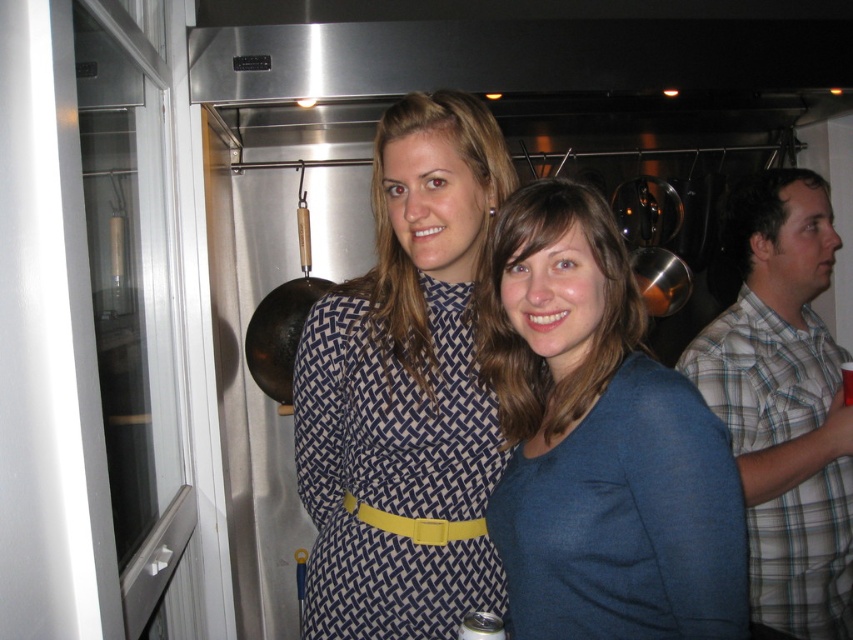
You are standing at the point marked as point (546, 422) in a kitchen scene. You want to take a photo of the two women in the foreground without moving. Can you do so without moving from your current position?

The distance between point (546, 422) and the camera is 1.06 meters. Since you are at point (546, 422), you can take the photo of the two women in the foreground without moving because the camera is within reach at that distance.

You are standing at the point with coordinates point (387,323) and want to move to the point with coordinates point (786,490). Given the scene described, is the destination point behind you or in front of you?

The destination point (786,490) is behind the starting point (387,323) according to the objects description, so it would be behind you.

You are a photographer setting up for a group photo. You notice the plaid shirt at right and the blue woven dress at center. Which of these two items is positioned lower in the image?

The plaid shirt at right is below the blue woven dress at center, so it is positioned lower in the image.